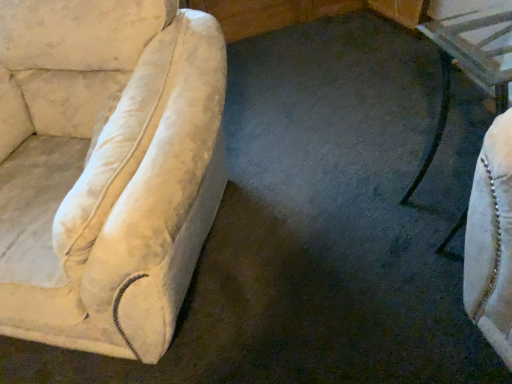
Describe the element at coordinates (469, 64) in the screenshot. I see `black metal table at right` at that location.

Identify the location of black metal table at right. (469, 64).

Measure the distance between black metal table at right and camera.

black metal table at right is 1.12 meters away from camera.

Locate an element on the screen. The image size is (512, 384). black metal table at right is located at coordinates (469, 64).